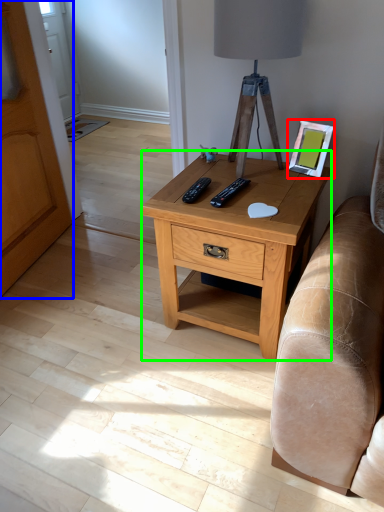
Question: Which object is the farthest from picture frame (highlighted by a red box)? Choose among these: armoire (highlighted by a blue box) or nightstand (highlighted by a green box).

Choices:
 (A) armoire
 (B) nightstand

Answer: (A)